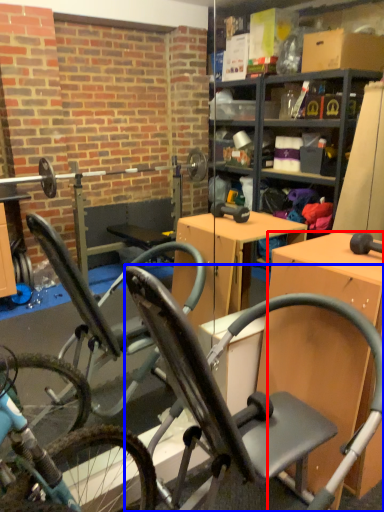
Question: Which point is further to the camera, desk (highlighted by a red box) or chair (highlighted by a blue box)?

Choices:
 (A) desk
 (B) chair

Answer: (A)